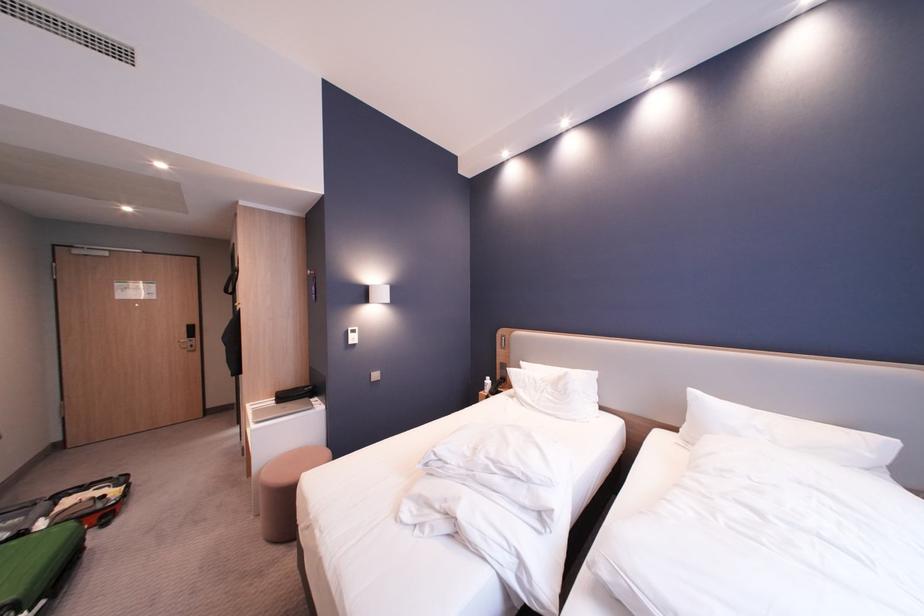
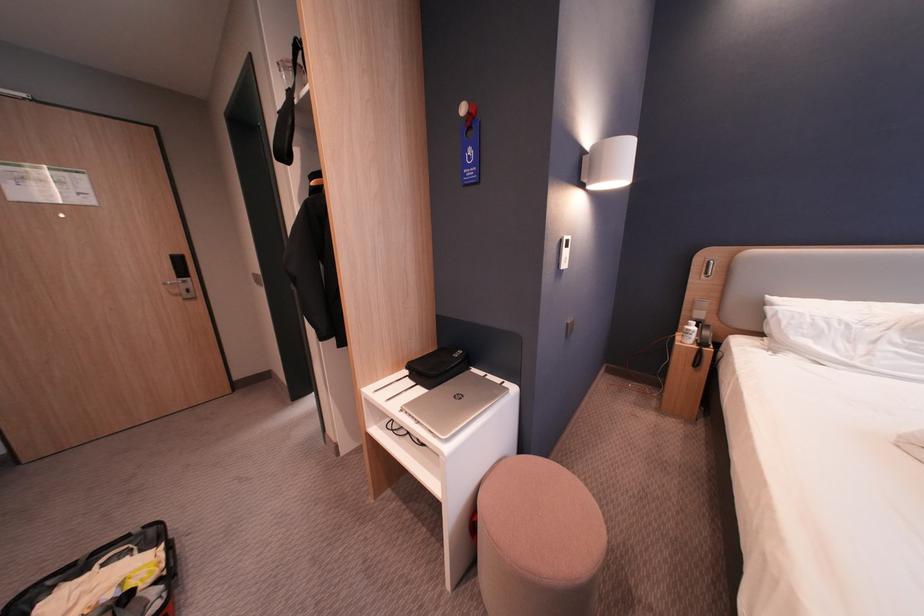
In the second image, find the point that corresponds to (x=317, y=390) in the first image.

(467, 357)